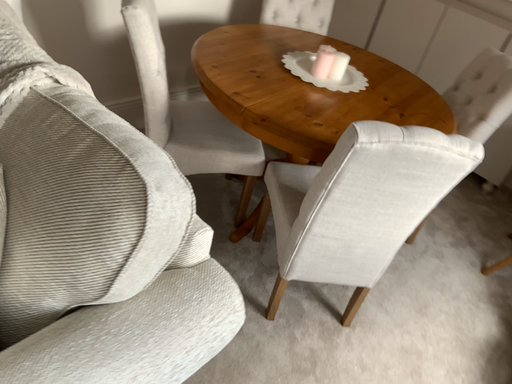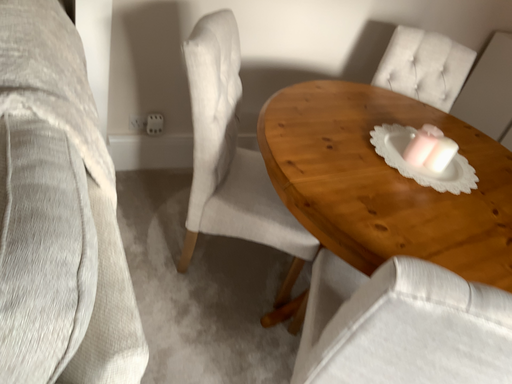
Question: Which way did the camera rotate in the video?

Choices:
 (A) rotated upward
 (B) rotated downward

Answer: (A)